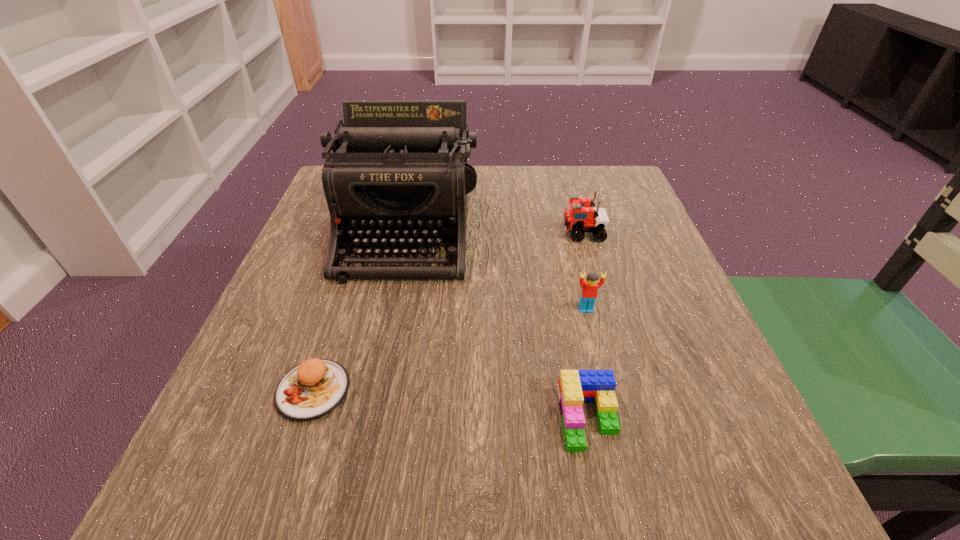
Where is `free space located 0.160m on the right of the patty`? Image resolution: width=960 pixels, height=540 pixels. free space located 0.160m on the right of the patty is located at coordinates (455, 390).

The height and width of the screenshot is (540, 960). I want to click on vacant space situated on the front of the shortest Lego, so click(x=604, y=498).

The height and width of the screenshot is (540, 960). What are the coordinates of `object situated at the far edge` in the screenshot? It's located at (399, 173).

Where is `object at the near edge`? object at the near edge is located at coordinates (575, 387).

Find the location of a particular element. The width and height of the screenshot is (960, 540). typewriter at the left edge is located at coordinates (399, 173).

Identify the location of patty positioned at the left edge. (312, 389).

In order to click on object at the right edge in this screenshot , I will do `click(581, 216)`.

Find the location of a particular element. Image resolution: width=960 pixels, height=540 pixels. object at the far left corner is located at coordinates (x=399, y=173).

I want to click on free spot at the far edge of the desktop, so click(x=506, y=201).

Where is `free space at the near edge of the desktop`? The image size is (960, 540). free space at the near edge of the desktop is located at coordinates (411, 478).